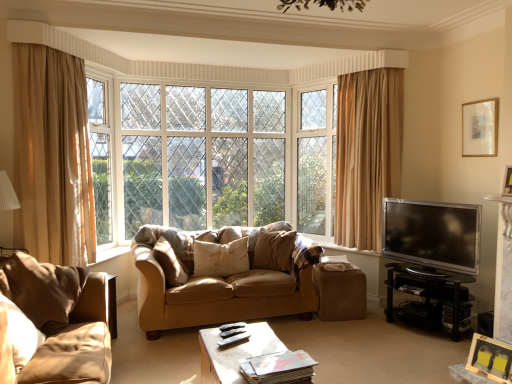
Question: Is wooden picture frame at lower right, which is the third picture frame from back to front, positioned before white painted wood window frame at upper left?

Choices:
 (A) yes
 (B) no

Answer: (A)

Question: From the image's perspective, is wooden picture frame at lower right, marked as the first picture frame in a front-to-back arrangement, located above white painted wood window frame at upper left?

Choices:
 (A) yes
 (B) no

Answer: (B)

Question: From a real-world perspective, is wooden picture frame at lower right, the first picture frame from the left, over white painted wood window frame at upper left?

Choices:
 (A) yes
 (B) no

Answer: (B)

Question: Is wooden picture frame at lower right, the first picture frame from the bottom, not close to white painted wood window frame at upper left?

Choices:
 (A) yes
 (B) no

Answer: (A)

Question: Can you confirm if wooden picture frame at lower right, the first picture frame from the bottom, is smaller than white painted wood window frame at upper left?

Choices:
 (A) yes
 (B) no

Answer: (A)

Question: Is white painted wood window frame at upper left bigger or smaller than velvet beige pillow at center, the first pillow viewed from the right?

Choices:
 (A) small
 (B) big

Answer: (B)

Question: Considering their positions, is white painted wood window frame at upper left located in front of or behind velvet beige pillow at center, the first pillow viewed from the right?

Choices:
 (A) front
 (B) behind

Answer: (B)

Question: In terms of width, does white painted wood window frame at upper left look wider or thinner when compared to velvet beige pillow at center, the first pillow viewed from the right?

Choices:
 (A) wide
 (B) thin

Answer: (B)

Question: In terms of height, does white painted wood window frame at upper left look taller or shorter compared to velvet beige pillow at center, the first pillow viewed from the right?

Choices:
 (A) tall
 (B) short

Answer: (A)

Question: Considering their positions, is beige fabric pillow at center, the 2th pillow from the right, located in front of or behind wooden picture frame at upper right, which is the 1th picture frame in back-to-front order?

Choices:
 (A) behind
 (B) front

Answer: (A)

Question: Is point (210, 256) positioned closer to the camera than point (471, 144)?

Choices:
 (A) farther
 (B) closer

Answer: (A)

Question: Considering the positions of beige fabric pillow at center, the 2th pillow viewed from the left, and wooden picture frame at upper right, arranged as the first picture frame when viewed from the top, in the image, is beige fabric pillow at center, the 2th pillow viewed from the left, wider or thinner than wooden picture frame at upper right, arranged as the first picture frame when viewed from the top,?

Choices:
 (A) thin
 (B) wide

Answer: (B)

Question: Looking at the image, does beige fabric pillow at center, the 2th pillow from the right, seem bigger or smaller compared to wooden picture frame at upper right, the 1th picture frame in the right-to-left sequence?

Choices:
 (A) small
 (B) big

Answer: (B)

Question: In the image, is wooden coffee table at center, which is counted as the first table, starting from the left, positioned in front of or behind suede couch at center, the 1th studio couch positioned from the back?

Choices:
 (A) behind
 (B) front

Answer: (B)

Question: Choose the correct answer: Is wooden coffee table at center, arranged as the second table when viewed from the right, inside suede couch at center, which is the second studio couch in left-to-right order, or outside it?

Choices:
 (A) outside
 (B) inside

Answer: (A)